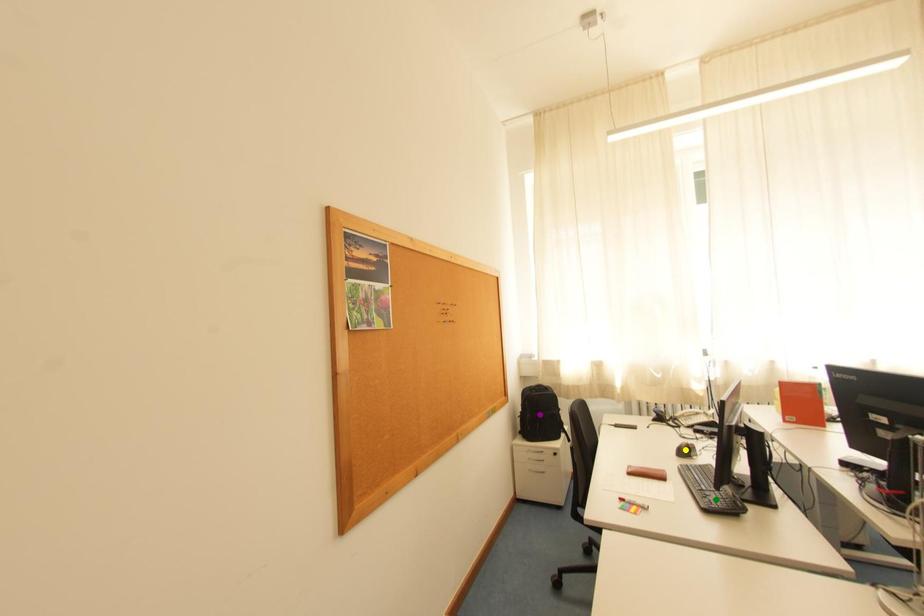
Consider the image. Order these from farthest to nearest:
purple point
green point
yellow point

purple point → yellow point → green point